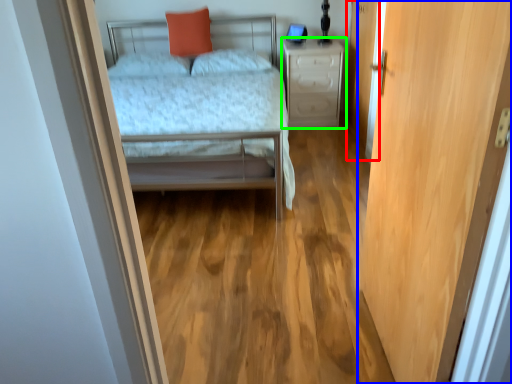
Question: Estimate the real-world distances between objects in this image. Which object is closer to screen door (highlighted by a red box), door (highlighted by a blue box) or nightstand (highlighted by a green box)?

Choices:
 (A) door
 (B) nightstand

Answer: (B)